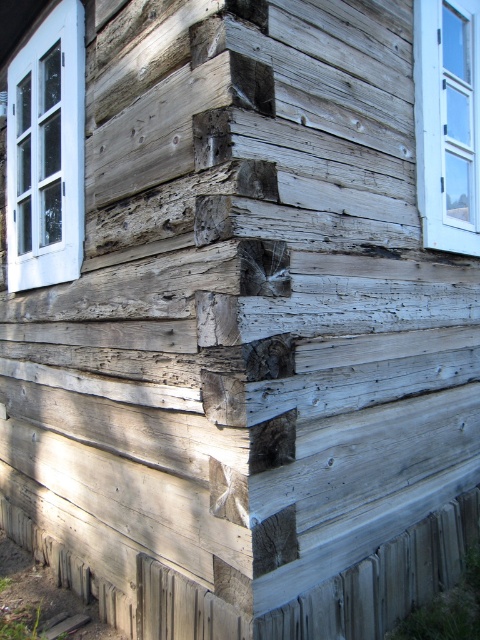
At what (x,y) coordinates should I click in order to perform the action: click on white wooden window at upper left. Please return your answer as a coordinate pair (x, y). Image resolution: width=480 pixels, height=640 pixels. Looking at the image, I should click on (46, 152).

In the scene shown: Between white wooden window at upper left and white wood window at upper right, which one appears on the left side from the viewer's perspective?

Positioned to the left is white wooden window at upper left.

The height and width of the screenshot is (640, 480). Describe the element at coordinates (46, 152) in the screenshot. I see `white wooden window at upper left` at that location.

Find the location of a particular element. The height and width of the screenshot is (640, 480). white wooden window at upper left is located at coordinates (46, 152).